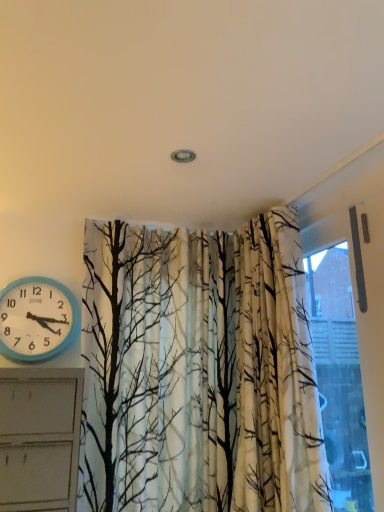
Question: Does transparent glass window at upper right come behind blue plastic wall clock at left?

Choices:
 (A) yes
 (B) no

Answer: (B)

Question: Considering the relative sizes of transparent glass window at upper right and blue plastic wall clock at left in the image provided, is transparent glass window at upper right smaller than blue plastic wall clock at left?

Choices:
 (A) no
 (B) yes

Answer: (A)

Question: From the image's perspective, is transparent glass window at upper right over blue plastic wall clock at left?

Choices:
 (A) yes
 (B) no

Answer: (B)

Question: Is transparent glass window at upper right positioned far away from blue plastic wall clock at left?

Choices:
 (A) no
 (B) yes

Answer: (B)

Question: From a real-world perspective, is transparent glass window at upper right beneath blue plastic wall clock at left?

Choices:
 (A) yes
 (B) no

Answer: (A)

Question: Does transparent glass window at upper right have a lesser width compared to blue plastic wall clock at left?

Choices:
 (A) yes
 (B) no

Answer: (A)

Question: Does blue plastic wall clock at left come behind transparent glass window at upper right?

Choices:
 (A) yes
 (B) no

Answer: (A)

Question: Could transparent glass window at upper right be considered to be inside blue plastic wall clock at left?

Choices:
 (A) yes
 (B) no

Answer: (B)

Question: Is blue plastic wall clock at left far away from transparent glass window at upper right?

Choices:
 (A) yes
 (B) no

Answer: (A)

Question: Considering the relative sizes of blue plastic wall clock at left and transparent glass window at upper right in the image provided, is blue plastic wall clock at left shorter than transparent glass window at upper right?

Choices:
 (A) no
 (B) yes

Answer: (B)

Question: Is blue plastic wall clock at left directly adjacent to transparent glass window at upper right?

Choices:
 (A) yes
 (B) no

Answer: (B)

Question: Considering the relative sizes of blue plastic wall clock at left and transparent glass window at upper right in the image provided, is blue plastic wall clock at left thinner than transparent glass window at upper right?

Choices:
 (A) no
 (B) yes

Answer: (A)

Question: From the image's perspective, is transparent glass window at upper right above or below blue plastic wall clock at left?

Choices:
 (A) below
 (B) above

Answer: (A)